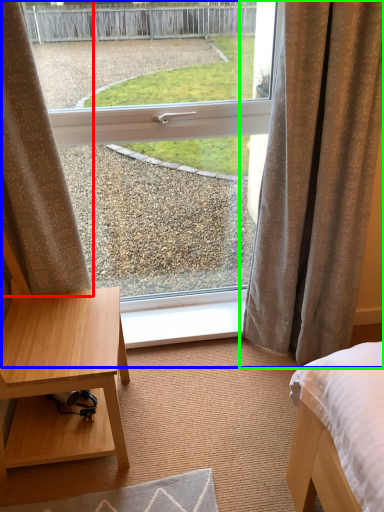
Question: Which object is the farthest from curtain (highlighted by a red box)? Choose among these: window (highlighted by a blue box) or curtain (highlighted by a green box).

Choices:
 (A) window
 (B) curtain

Answer: (A)